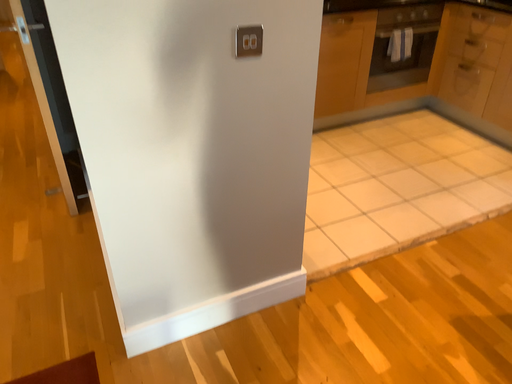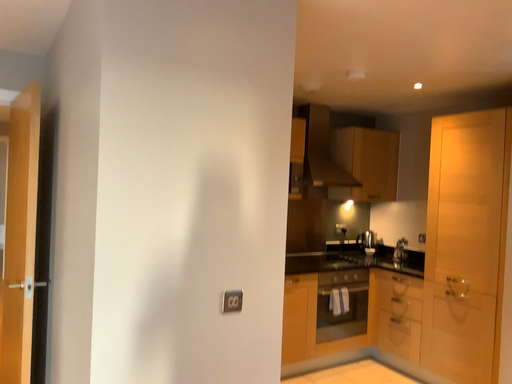
Question: How did the camera likely rotate when shooting the video?

Choices:
 (A) rotated upward
 (B) rotated downward

Answer: (A)